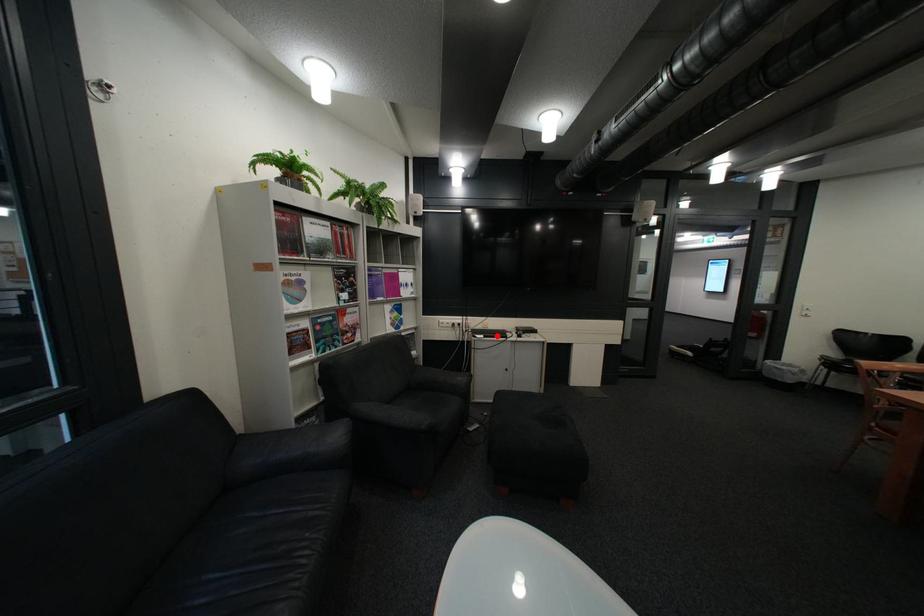
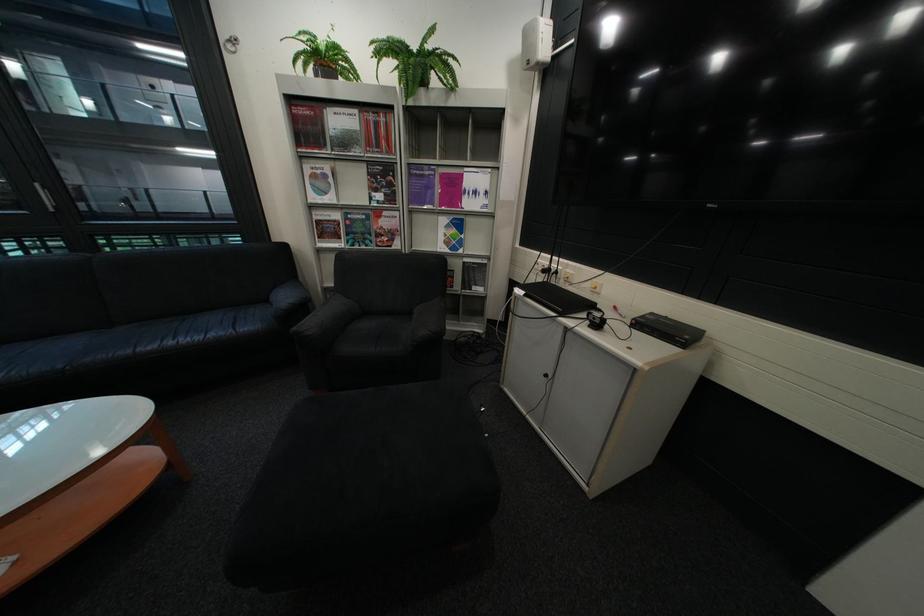
In the second image, find the point that corresponds to the highlighted location in the first image.

(538, 293)